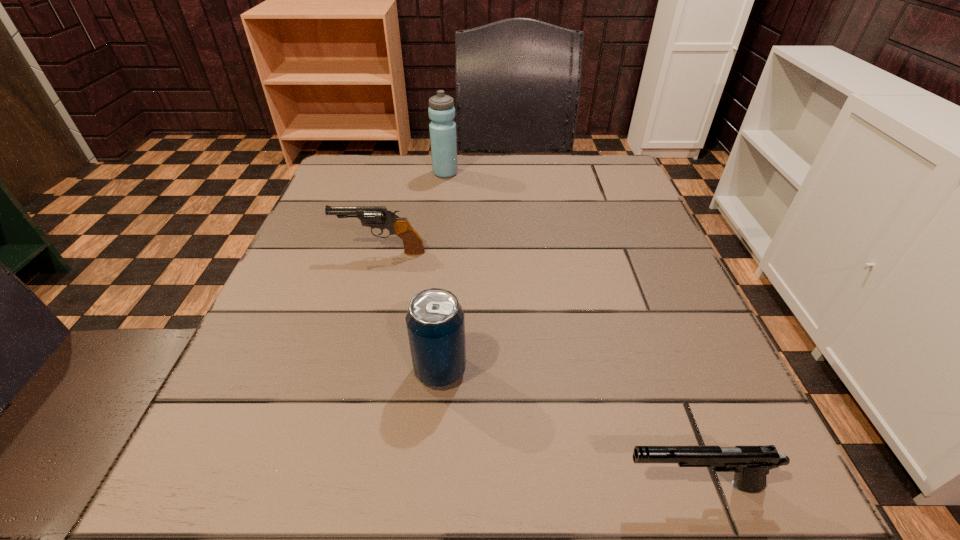
Locate an element on the screen. The height and width of the screenshot is (540, 960). vacant position located 0.050m along the barrel of the farther gun is located at coordinates (311, 252).

Find the location of a particular element. The width and height of the screenshot is (960, 540). vacant space located along the barrel of the farther gun is located at coordinates (306, 252).

At what (x,y) coordinates should I click in order to perform the action: click on free space located along the barrel of the farther gun. Please return your answer as a coordinate pair (x, y). This screenshot has width=960, height=540. Looking at the image, I should click on (297, 252).

Where is `vacant space located 0.350m at the aiming end of the shorter gun`? This screenshot has width=960, height=540. vacant space located 0.350m at the aiming end of the shorter gun is located at coordinates (334, 485).

Identify the location of free region located at the aiming end of the shorter gun. The width and height of the screenshot is (960, 540). (310, 485).

Identify the location of free location located 0.150m at the aiming end of the shorter gun. (498, 485).

Find the location of a particular element. The height and width of the screenshot is (540, 960). object positioned at the far edge is located at coordinates (441, 111).

Where is `object that is at the near edge`? The image size is (960, 540). object that is at the near edge is located at coordinates (751, 464).

Locate an element on the screen. The image size is (960, 540). object present at the left edge is located at coordinates (379, 217).

The image size is (960, 540). I want to click on object located at the right edge, so click(x=751, y=464).